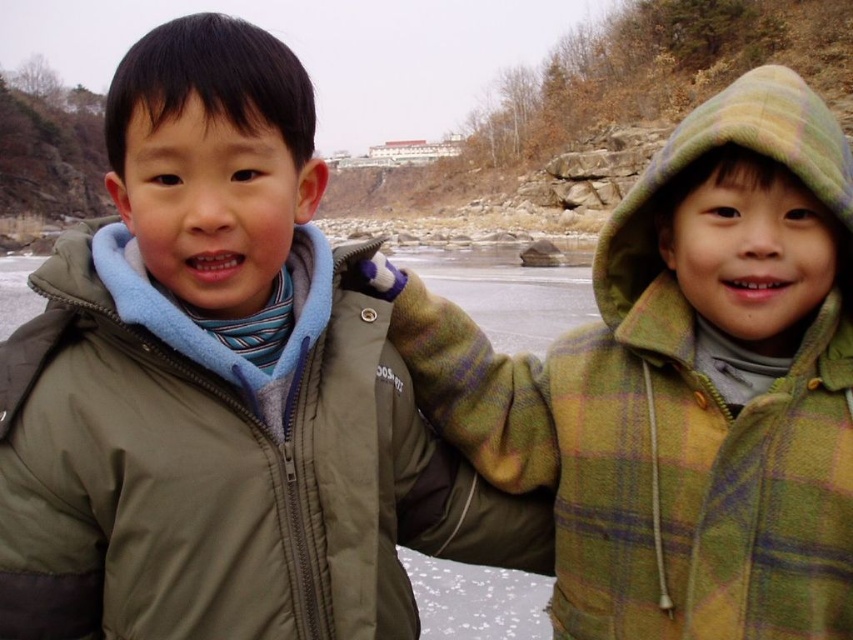
You are a photographer standing at the camera position. You want to capture a photo of the two children while including a specific point in the background. The point is located at coordinates point (80, 490). If your camera has a depth of field that can clearly capture objects within 25 meters, will both the children and the point be in focus?

The distance of point (80, 490) is 28.00 meters from the camera. Since the depth of field can only clearly capture objects within 25 meters, the point will be out of focus. However, the children are closer than 25 meters, so they will be in focus.

You are a photographer trying to capture the olive green puffer jacket at left in the image. What are the coordinates where you should focus your camera?

The olive green puffer jacket at left is located at coordinates point (224, 465).

You are a photographer trying to capture both the green plaid jacket at right and the olive green puffer jacket at left in a single frame. Based on their positions, which jacket is closer to the camera?

The green plaid jacket at right is closer to the camera because the olive green puffer jacket at left is positioned behind it.